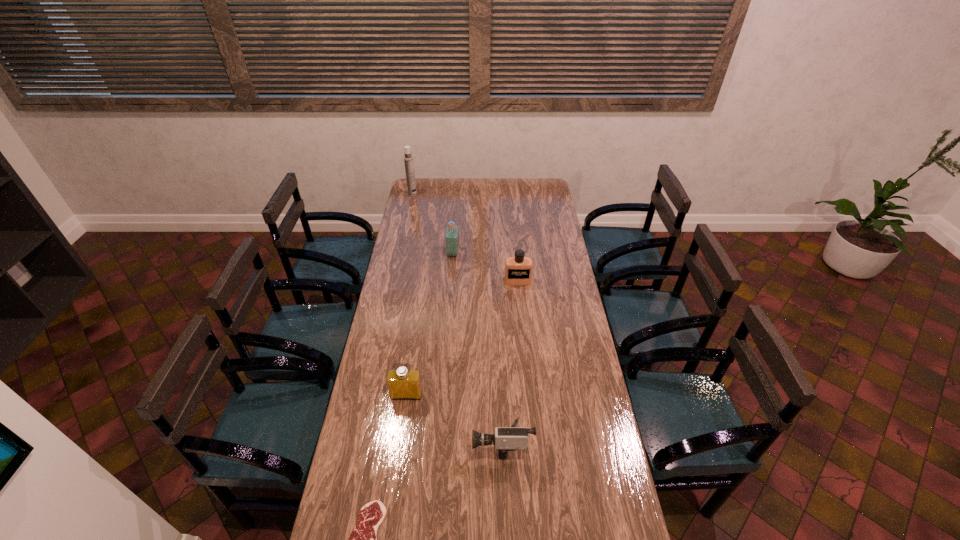
Where is `free region located 0.070m on the front label of the third object from right to left`? The width and height of the screenshot is (960, 540). free region located 0.070m on the front label of the third object from right to left is located at coordinates (473, 253).

Image resolution: width=960 pixels, height=540 pixels. What are the coordinates of `vacant space positioned 0.060m on the front label of the second nearest perfume` in the screenshot? It's located at (519, 294).

The width and height of the screenshot is (960, 540). In order to click on free space located on the front-facing side of the third nearest object in this screenshot , I will do `click(397, 459)`.

This screenshot has height=540, width=960. In order to click on free region located 0.200m on the recording direction of the camcorder in this screenshot , I will do `click(414, 443)`.

Where is `free space located 0.140m on the recording direction of the camcorder`? Image resolution: width=960 pixels, height=540 pixels. free space located 0.140m on the recording direction of the camcorder is located at coordinates (432, 443).

In order to click on blank area located on the recording direction of the camcorder in this screenshot , I will do `click(417, 443)`.

The width and height of the screenshot is (960, 540). In order to click on object that is at the far edge in this screenshot , I will do point(408,158).

Where is `aerosol can that is at the left edge`? This screenshot has height=540, width=960. aerosol can that is at the left edge is located at coordinates (408, 158).

At what (x,y) coordinates should I click in order to perform the action: click on perfume present at the left edge. Please return your answer as a coordinate pair (x, y). Looking at the image, I should click on (403, 383).

This screenshot has height=540, width=960. I want to click on object situated at the far left corner, so click(x=408, y=158).